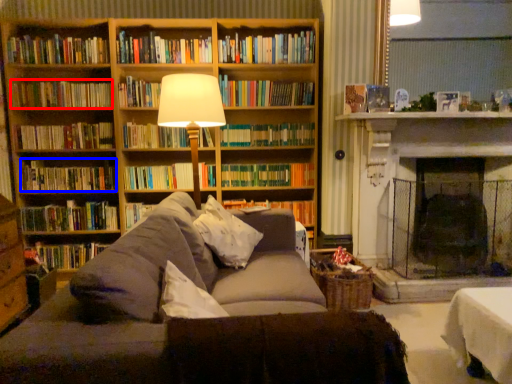
Question: Which object appears closest to the camera in this image, book (highlighted by a red box) or book (highlighted by a blue box)?

Choices:
 (A) book
 (B) book

Answer: (A)